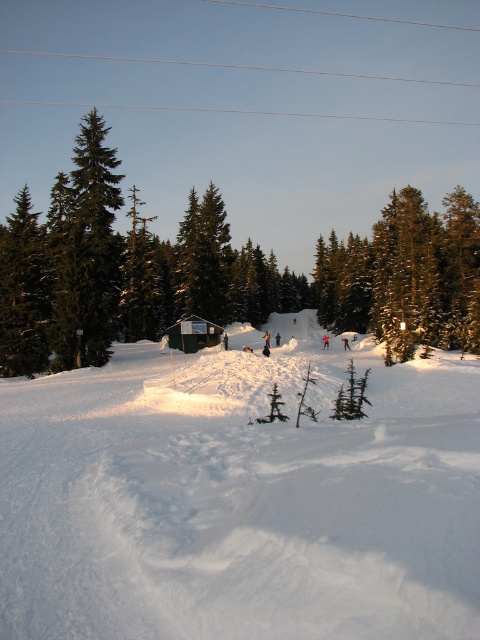
Does white powdery snow at center have a greater width compared to white plastic tent at center?

Indeed, white powdery snow at center has a greater width compared to white plastic tent at center.

Describe the element at coordinates (240, 497) in the screenshot. The image size is (480, 640). I see `white powdery snow at center` at that location.

Locate an element on the screen. white powdery snow at center is located at coordinates (240, 497).

Does green matte tree at center have a lesser height compared to snow-covered evergreen tree at center?

No.

Locate an element on the screen. This screenshot has width=480, height=640. green matte tree at center is located at coordinates (208, 269).

Between point (48, 236) and point (388, 234), which one is positioned behind?

The point (388, 234) is more distant.

I want to click on green matte tree at center, so click(x=208, y=269).

Identify the location of white powdery snow at center. (240, 497).

Who is higher up, white powdery snow at center or snow-covered evergreen tree at center?

snow-covered evergreen tree at center is higher up.

Between point (381, 445) and point (380, 320), which one is positioned in front?

Point (381, 445)

Where is `white powdery snow at center`? The image size is (480, 640). white powdery snow at center is located at coordinates click(240, 497).